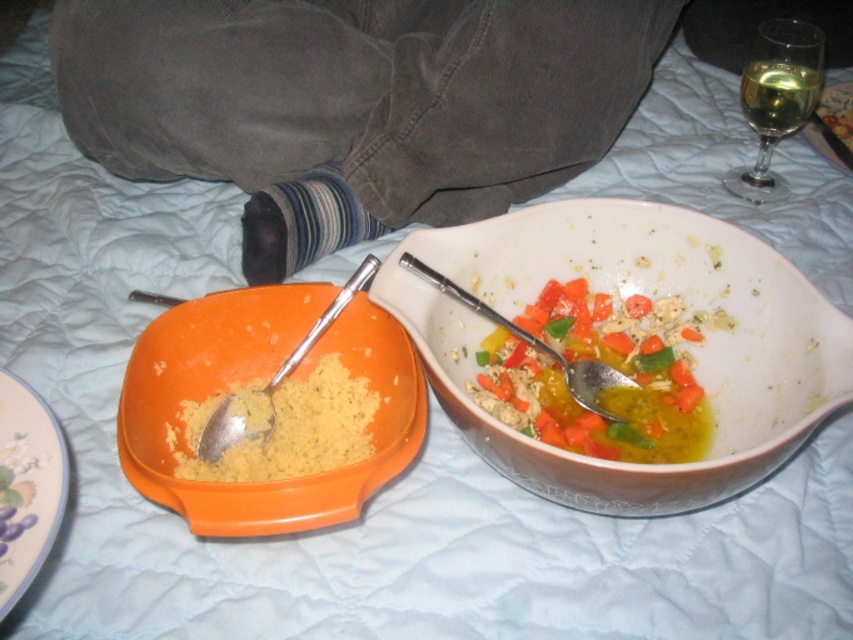
Does multicolored vegetables at center have a greater width compared to gold metallic plate at upper right?

Yes, multicolored vegetables at center is wider than gold metallic plate at upper right.

Does multicolored vegetables at center appear on the left side of gold metallic plate at upper right?

Indeed, multicolored vegetables at center is positioned on the left side of gold metallic plate at upper right.

Which is in front, point (694, 424) or point (804, 131)?

Point (694, 424) is in front.

This screenshot has height=640, width=853. Identify the location of multicolored vegetables at center. (602, 394).

Does multicolored vegetables at center appear over silver metallic spoon at center?

Actually, multicolored vegetables at center is below silver metallic spoon at center.

Locate an element on the screen. Image resolution: width=853 pixels, height=640 pixels. multicolored vegetables at center is located at coordinates (602, 394).

In order to click on multicolored vegetables at center in this screenshot , I will do `click(602, 394)`.

Between white matte bowl at center and silver metallic spoon at center, which one appears on the left side from the viewer's perspective?

silver metallic spoon at center

Between white matte bowl at center and silver metallic spoon at center, which one is positioned higher?

silver metallic spoon at center is above.

Does point (663, 285) come farther from viewer compared to point (599, 374)?

Yes.

Identify the location of white matte bowl at center. (624, 298).